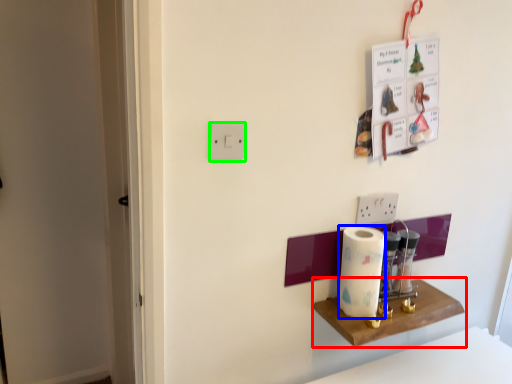
Question: Estimate the real-world distances between objects in this image. Which object is closer to shelf (highlighted by a red box), paper towel (highlighted by a blue box) or light switch (highlighted by a green box)?

Choices:
 (A) paper towel
 (B) light switch

Answer: (A)